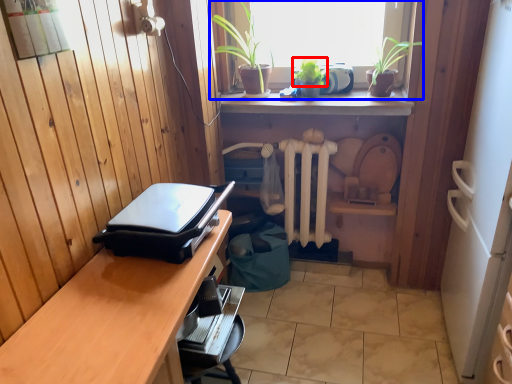
Question: Which point is further to the camera, plant (highlighted by a red box) or window (highlighted by a blue box)?

Choices:
 (A) plant
 (B) window

Answer: (B)